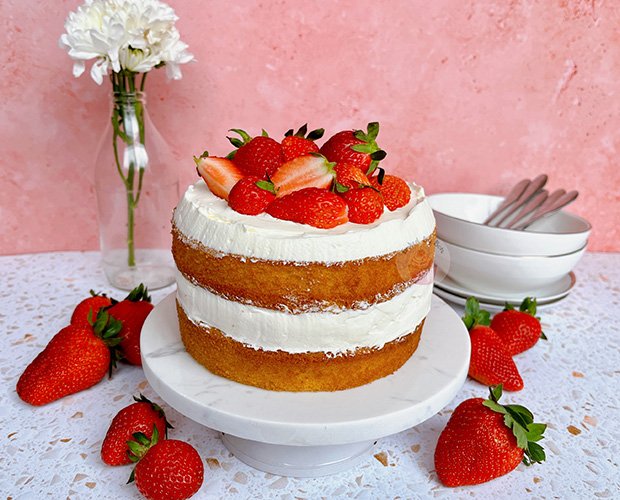
Locate an element on the screen. silverware is located at coordinates (511, 192), (534, 183), (532, 203), (547, 202), (558, 201).